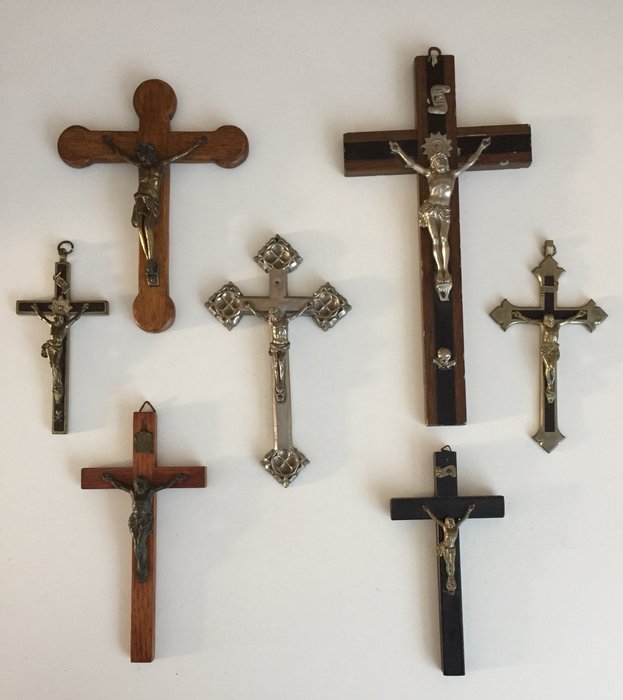
I want to click on leg, so click(443, 244), click(146, 234), click(278, 365).